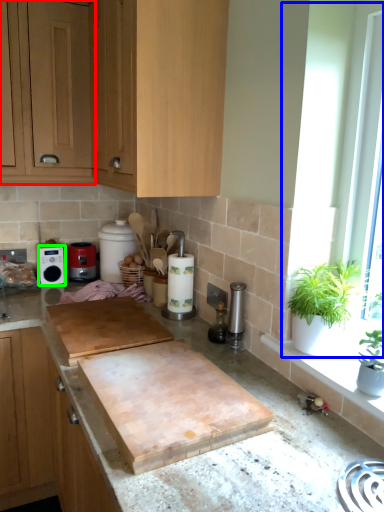
Question: Which is farther away from cabinetry (highlighted by a red box)? window frame (highlighted by a blue box) or appliance (highlighted by a green box)?

Choices:
 (A) window frame
 (B) appliance

Answer: (A)